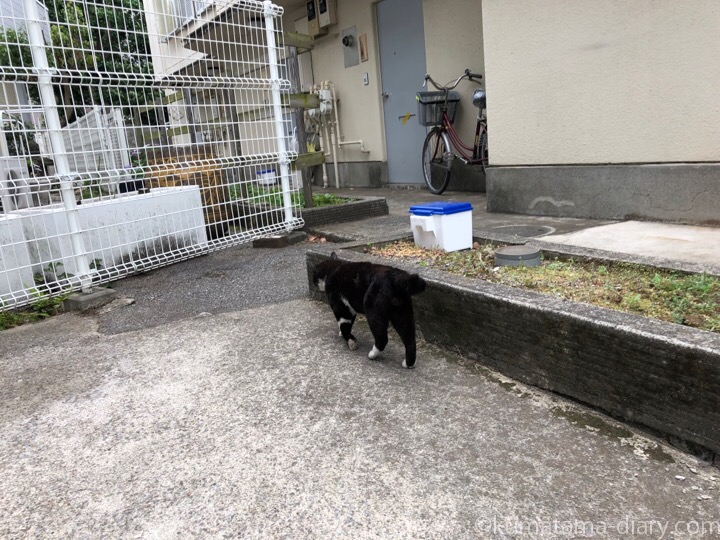
At what (x,y) coordinates should I click in order to perform the action: click on wall. Please return your answer as a coordinate pair (x, y). Looking at the image, I should click on (626, 68).